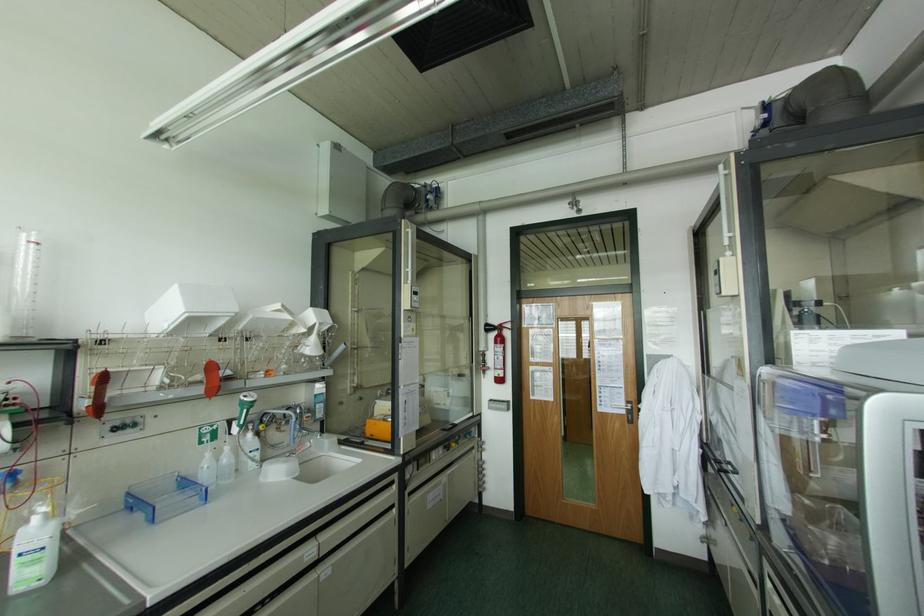
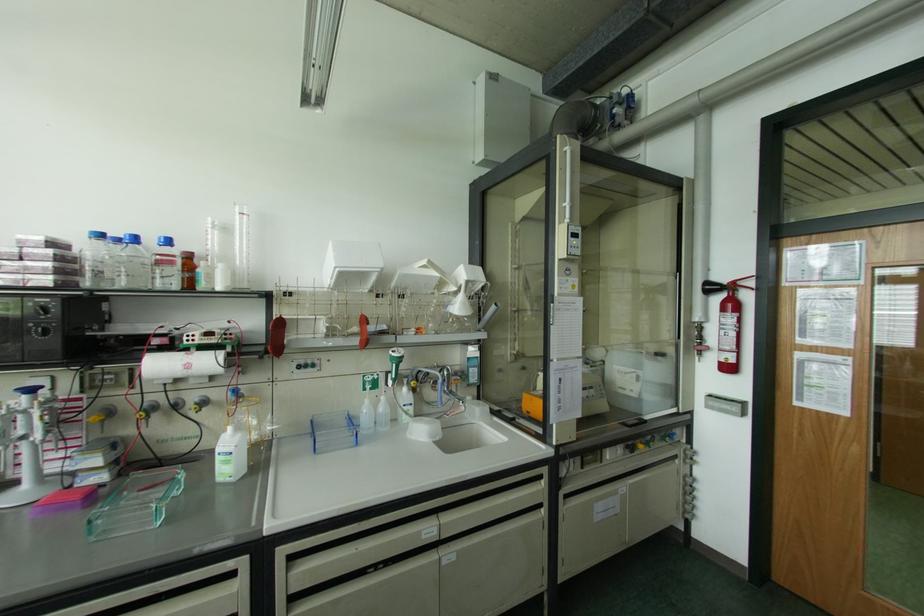
The point at [487,323] is marked in the first image. Where is the corresponding point in the second image?

(707, 283)